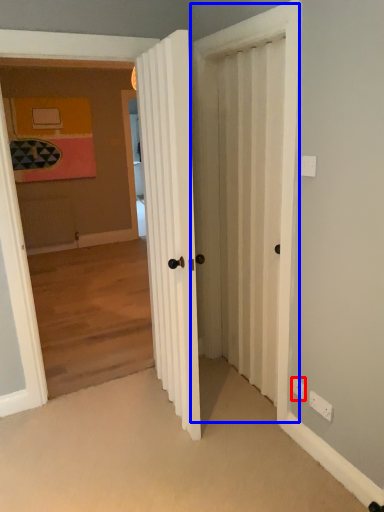
Question: Which point is closer to the camera, electric outlet (highlighted by a red box) or screen door (highlighted by a blue box)?

Choices:
 (A) electric outlet
 (B) screen door

Answer: (B)